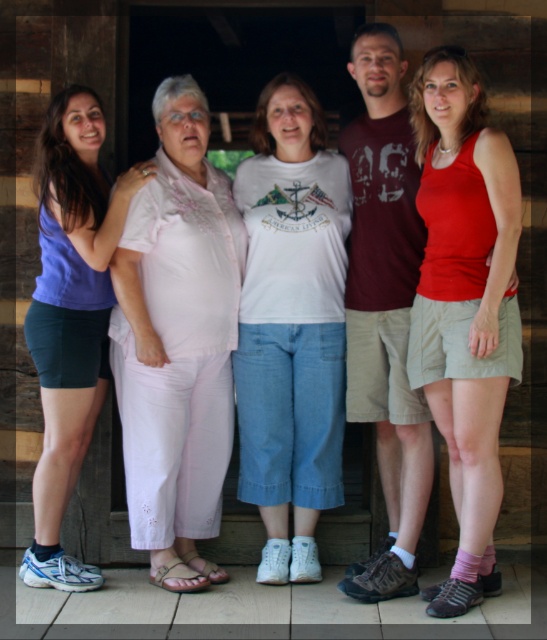
Based on the scene description, which person is wearing the red matte tank top at center and how does their height compare to the person in the matte purple tank top at left?

The person wearing the red matte tank top at center is much taller than the person in the matte purple tank top at left.